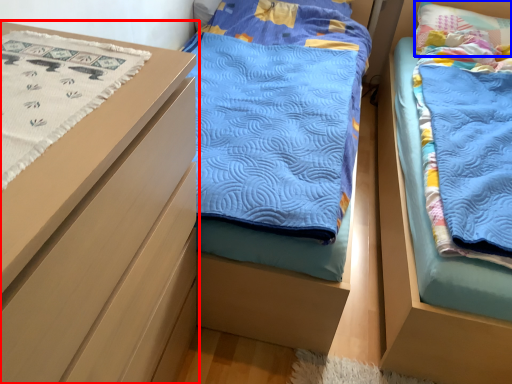
Question: Among these objects, which one is farthest to the camera, chest of drawers (highlighted by a red box) or pillow (highlighted by a blue box)?

Choices:
 (A) chest of drawers
 (B) pillow

Answer: (B)